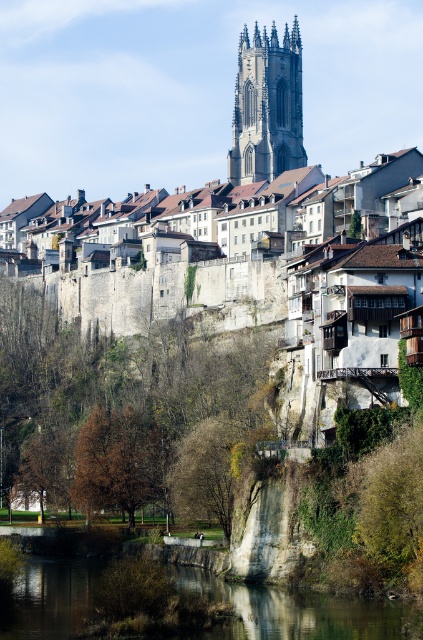
Question: Which point appears farthest from the camera in this image?

Choices:
 (A) (54, 620)
 (B) (288, 70)

Answer: (B)

Question: Can you confirm if green stone river at lower center is smaller than smooth stone tower at upper center?

Choices:
 (A) yes
 (B) no

Answer: (A)

Question: Which object appears farthest from the camera in this image?

Choices:
 (A) green stone river at lower center
 (B) smooth stone tower at upper center

Answer: (B)

Question: Does green stone river at lower center have a larger size compared to smooth stone tower at upper center?

Choices:
 (A) yes
 (B) no

Answer: (B)

Question: Does green stone river at lower center lie behind smooth stone tower at upper center?

Choices:
 (A) yes
 (B) no

Answer: (B)